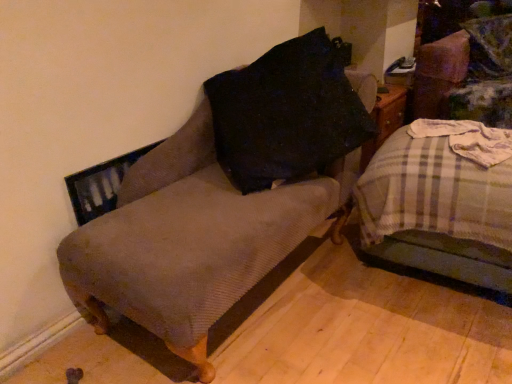
Question: Can you confirm if textured brown armchair at left is positioned to the right of plaid fabric bed at right?

Choices:
 (A) no
 (B) yes

Answer: (A)

Question: Does textured brown armchair at left appear on the left side of plaid fabric bed at right?

Choices:
 (A) yes
 (B) no

Answer: (A)

Question: Considering the relative positions of textured brown armchair at left and plaid fabric bed at right in the image provided, is textured brown armchair at left behind plaid fabric bed at right?

Choices:
 (A) yes
 (B) no

Answer: (B)

Question: Can we say textured brown armchair at left lies outside plaid fabric bed at right?

Choices:
 (A) no
 (B) yes

Answer: (B)

Question: From the image's perspective, does textured brown armchair at left appear higher than plaid fabric bed at right?

Choices:
 (A) yes
 (B) no

Answer: (A)

Question: Is textured brown armchair at left wider than plaid fabric bed at right?

Choices:
 (A) yes
 (B) no

Answer: (B)

Question: Is textured brown armchair at left facing towards velvet green swivel chair at upper right?

Choices:
 (A) no
 (B) yes

Answer: (A)

Question: Is textured brown armchair at left not within velvet green swivel chair at upper right?

Choices:
 (A) no
 (B) yes

Answer: (B)

Question: Does textured brown armchair at left have a lesser width compared to velvet green swivel chair at upper right?

Choices:
 (A) yes
 (B) no

Answer: (B)

Question: Considering the relative sizes of textured brown armchair at left and velvet green swivel chair at upper right in the image provided, is textured brown armchair at left smaller than velvet green swivel chair at upper right?

Choices:
 (A) yes
 (B) no

Answer: (B)

Question: Considering the relative sizes of textured brown armchair at left and velvet green swivel chair at upper right in the image provided, is textured brown armchair at left shorter than velvet green swivel chair at upper right?

Choices:
 (A) yes
 (B) no

Answer: (B)

Question: Is textured brown armchair at left in front of velvet green swivel chair at upper right?

Choices:
 (A) no
 (B) yes

Answer: (B)

Question: Can you confirm if plaid fabric bed at right is taller than textured brown armchair at left?

Choices:
 (A) no
 (B) yes

Answer: (A)